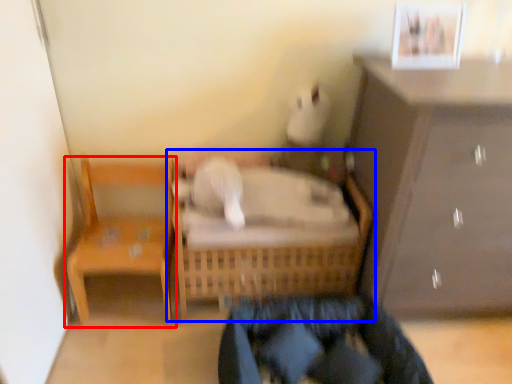
Question: Which object appears farthest to the camera in this image, chair (highlighted by a red box) or furniture (highlighted by a blue box)?

Choices:
 (A) chair
 (B) furniture

Answer: (B)